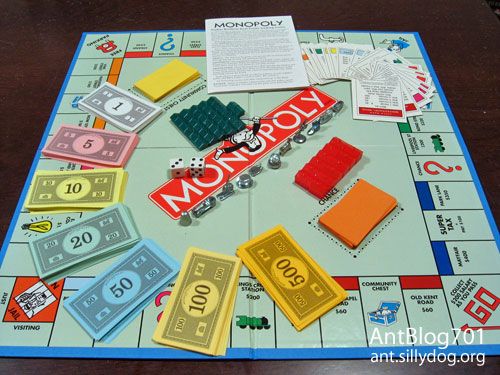
Image resolution: width=500 pixels, height=375 pixels. Identify the location of pile of fake game money. (114, 103), (85, 141), (74, 190), (79, 241), (121, 293), (201, 302), (290, 277).